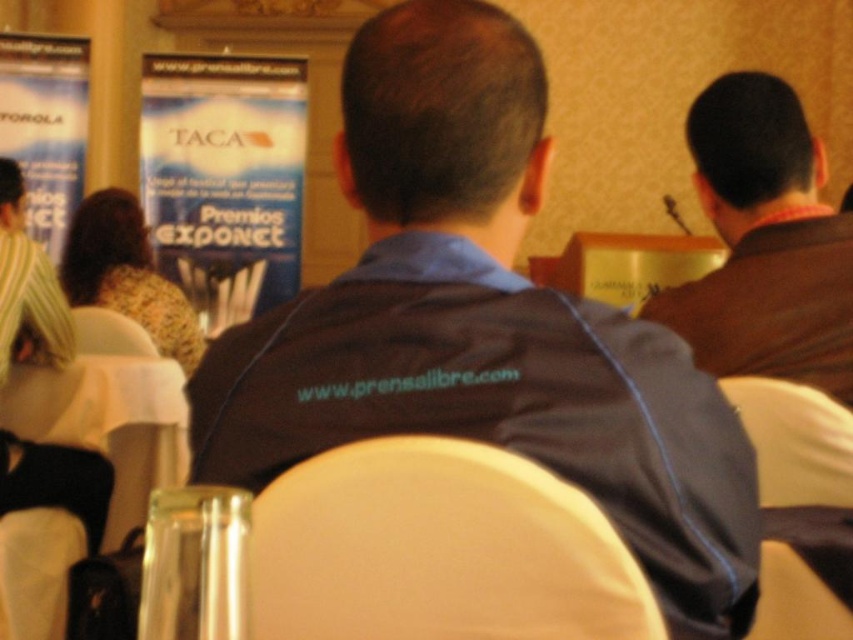
You are organizing a cleanup at the event and need to know the sizes of items to sort them. Which object is wider, the clear plastic bottle at lower left or the white plastic chair at center?

The clear plastic bottle at lower left is wider than the white plastic chair at center according to the description.

You are a photographer setting up for an event. You need to place a camera stand 1 meter away from the white fabric chair at center to capture a clear shot. Is the current distance sufficient?

The white fabric chair at center is currently 76.07 centimeters away from the camera, which is less than 1 meter. To meet the requirement, the camera stand needs to be moved further back to ensure the distance reaches at least 1 meter.

You are standing in the conference room and need to find the clear plastic bottle at lower left. According to the coordinates given, where exactly should you look to locate it?

The clear plastic bottle at lower left is located at coordinates point (108, 422).